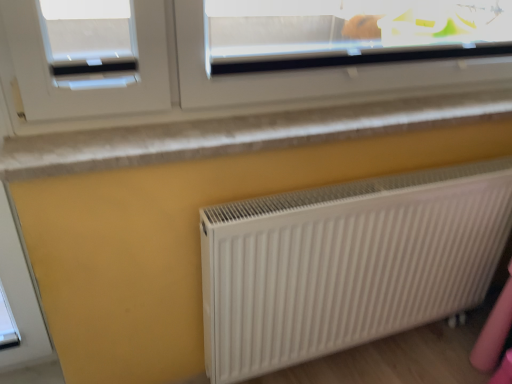
Question: Visually, is white ribbed radiator at lower right positioned to the left or to the right of white textured window sill at upper center?

Choices:
 (A) left
 (B) right

Answer: (B)

Question: Is white ribbed radiator at lower right in front of or behind white textured window sill at upper center in the image?

Choices:
 (A) behind
 (B) front

Answer: (A)

Question: Is point (292, 269) closer or farther from the camera than point (40, 175)?

Choices:
 (A) farther
 (B) closer

Answer: (A)

Question: Which is correct: white textured window sill at upper center is inside white ribbed radiator at lower right, or outside of it?

Choices:
 (A) outside
 (B) inside

Answer: (A)

Question: In terms of width, does white textured window sill at upper center look wider or thinner when compared to white ribbed radiator at lower right?

Choices:
 (A) wide
 (B) thin

Answer: (A)

Question: Is point (458, 102) closer or farther from the camera than point (492, 188)?

Choices:
 (A) closer
 (B) farther

Answer: (A)

Question: From a real-world perspective, relative to white ribbed radiator at lower right, is white textured window sill at upper center vertically above or below?

Choices:
 (A) above
 (B) below

Answer: (A)